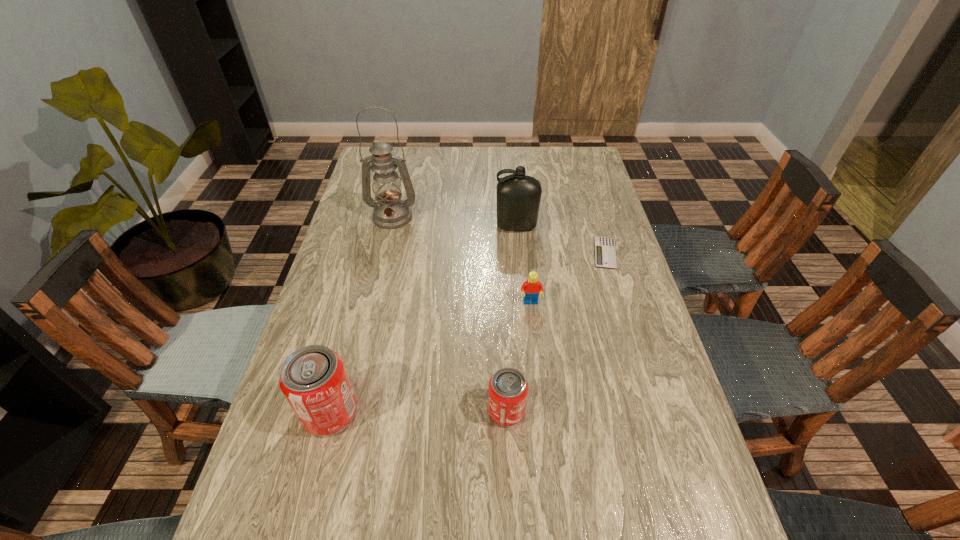
Identify the location of free region located on the front of the tallest object. Image resolution: width=960 pixels, height=540 pixels. (372, 309).

This screenshot has width=960, height=540. Find the location of `vacant point located on the left of the second tallest object`. vacant point located on the left of the second tallest object is located at coordinates 387,226.

You are a GUI agent. You are given a task and a screenshot of the screen. Output one action in this format:
    pyautogui.click(x=<x>, y=<y>)
    Task: Click on the vacant space located on the front of the rightmost object
    Image resolution: width=960 pixels, height=540 pixels.
    Given the screenshot: What is the action you would take?
    pyautogui.click(x=637, y=362)

Locate an element on the screen. This screenshot has width=960, height=540. free point located 0.250m on the face of the Lego is located at coordinates (540, 388).

Locate an element on the screen. This screenshot has height=540, width=960. can that is at the left edge is located at coordinates (313, 379).

Find the location of a particular element. oil lamp that is at the left edge is located at coordinates (390, 212).

Where is `object that is at the right edge`? object that is at the right edge is located at coordinates (605, 253).

Where is `vacant space at the far edge of the desktop`? vacant space at the far edge of the desktop is located at coordinates coord(552,173).

Where is `blank space at the left edge`? Image resolution: width=960 pixels, height=540 pixels. blank space at the left edge is located at coordinates (382, 255).

In the image, there is a desktop. What are the coordinates of `free region at the right edge` in the screenshot? It's located at (595, 218).